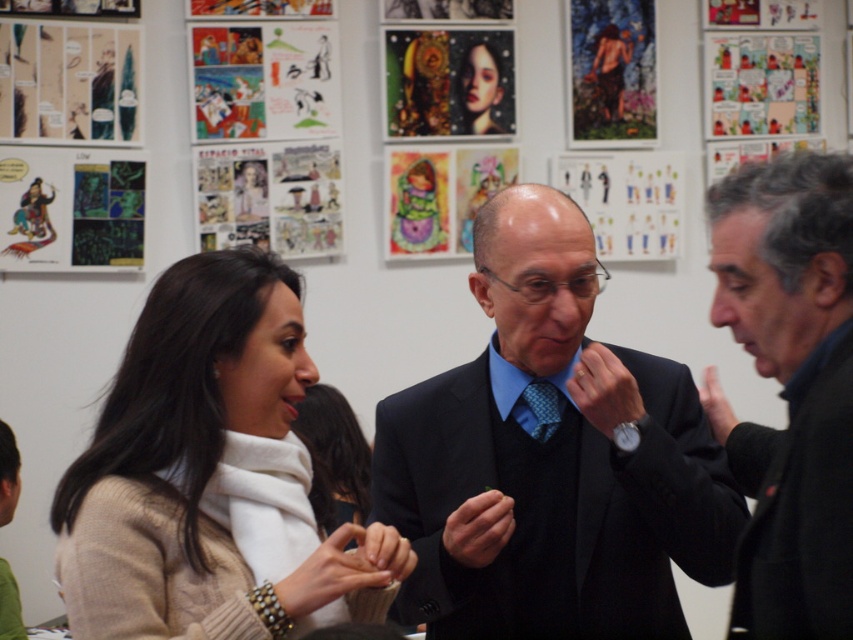
Does point (445, 552) come farther from viewer compared to point (793, 307)?

Yes, it is.

Which of these two, matte black suit at center or black wool jacket at right, stands taller?

Standing taller between the two is matte black suit at center.

Which is behind, point (706, 532) or point (807, 227)?

Point (706, 532)

Find the location of a particular element. The image size is (853, 640). matte black suit at center is located at coordinates (550, 458).

Between beige sweater at left and black wool jacket at right, which one appears on the right side from the viewer's perspective?

black wool jacket at right is more to the right.

How far apart are beige sweater at left and black wool jacket at right?

beige sweater at left is 26.79 inches away from black wool jacket at right.

Who is more forward, (206, 509) or (743, 346)?

Point (743, 346) is in front.

Find the location of `beige sweater at left`. beige sweater at left is located at coordinates (212, 476).

Who is higher up, matte black suit at center or beige sweater at left?

matte black suit at center is above.

The height and width of the screenshot is (640, 853). What are the coordinates of `matte black suit at center` in the screenshot? It's located at (550, 458).